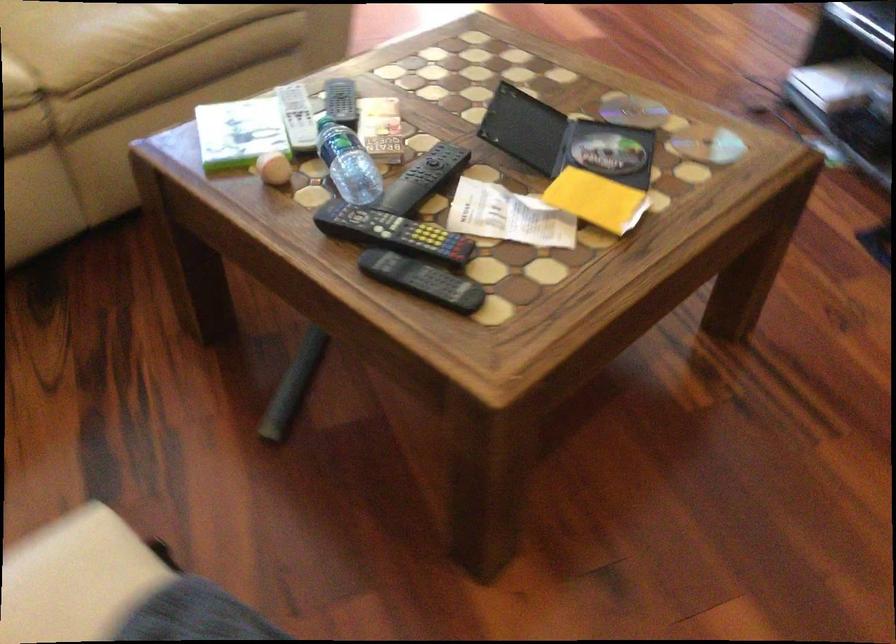
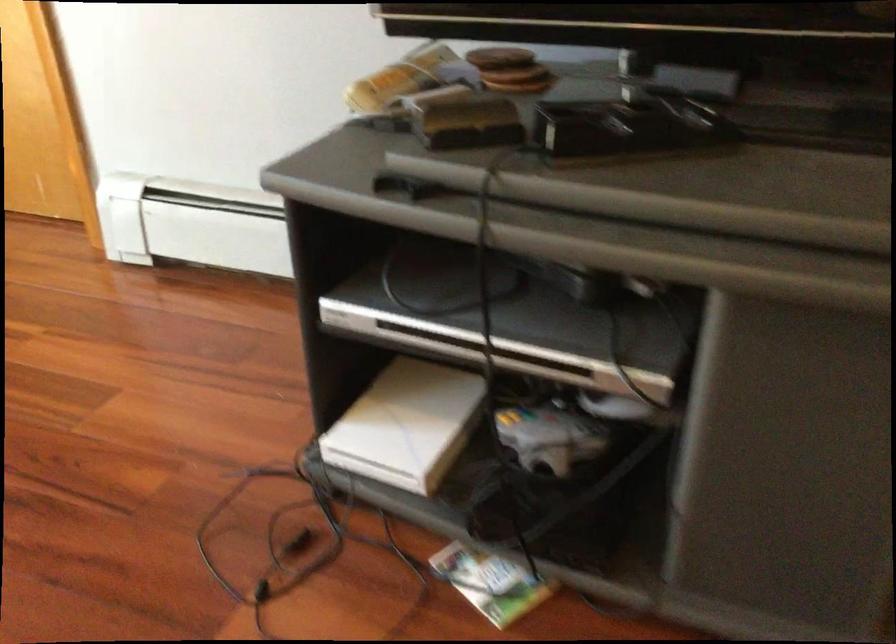
Locate, in the second image, the point that corresponds to the point at 814,82 in the first image.

(407, 424)